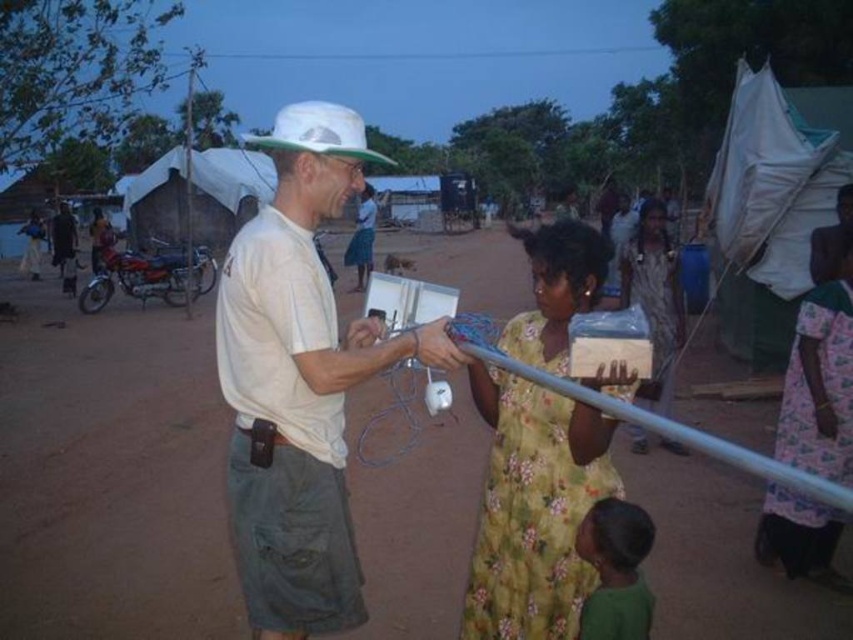
Question: Which object is farther from the camera taking this photo?

Choices:
 (A) green matte shirt at lower center
 (B) yellow floral dress at center

Answer: (B)

Question: Among these points, which one is nearest to the camera?

Choices:
 (A) (668, 368)
 (B) (547, 426)
 (C) (383, 364)

Answer: (C)

Question: Can you confirm if brown dirt field at center is bigger than floral print dress at center?

Choices:
 (A) yes
 (B) no

Answer: (A)

Question: Which of the following is the farthest from the observer?

Choices:
 (A) coord(659,300)
 (B) coord(305,150)
 (C) coord(427,444)

Answer: (C)

Question: Can you confirm if brown dirt field at center is positioned to the left of green matte shirt at lower center?

Choices:
 (A) yes
 (B) no

Answer: (A)

Question: Can you confirm if yellow floral dress at center is positioned below floral print dress at center?

Choices:
 (A) yes
 (B) no

Answer: (A)